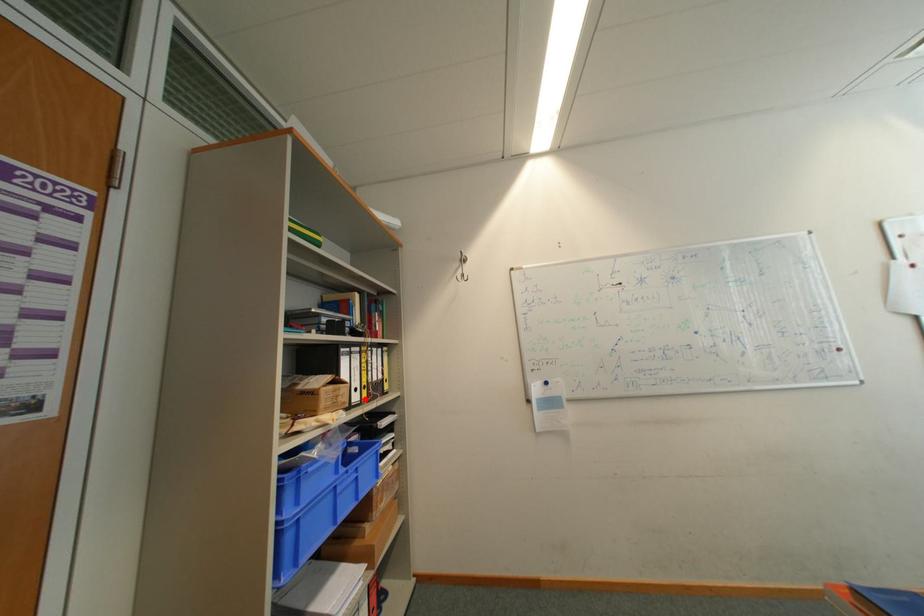
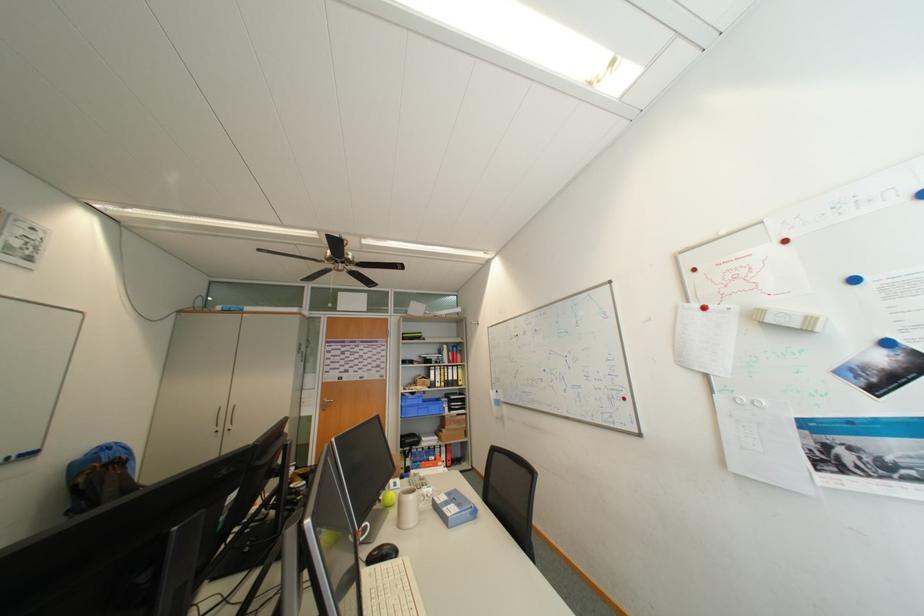
Question: I am providing you with two images of the same scene from different viewpoints. A red point is shown in image1. For the corresponding object point in image2, is it positioned nearer or farther from the camera?

Choices:
 (A) Nearer
 (B) Farther

Answer: (B)